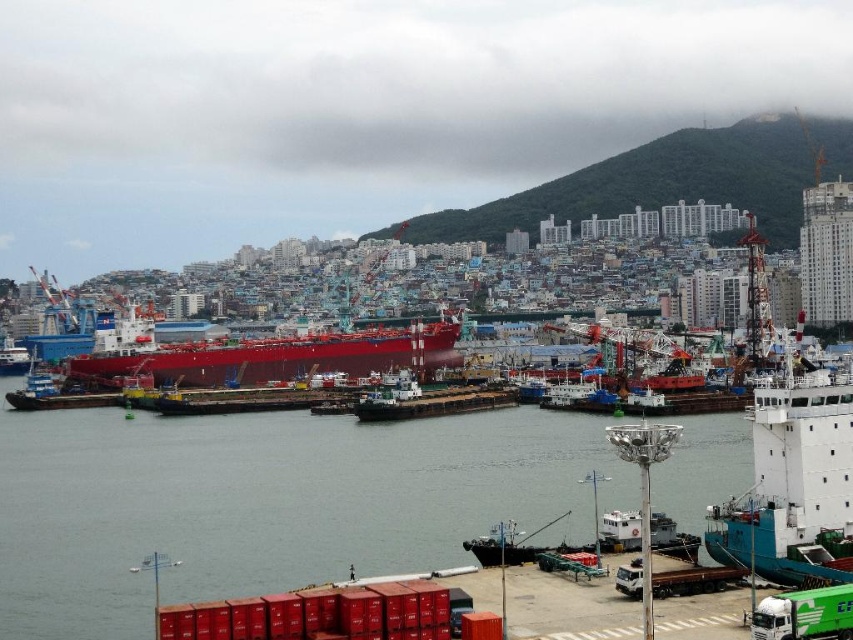
Between transparent water at center and white matte ship at right, which one has more height?

white matte ship at right

Does point (28, 614) lie in front of point (781, 392)?

No.

In order to click on transparent water at center in this screenshot , I will do `click(268, 502)`.

Is white matte ship at right smaller than glossy red ship at center?

Actually, white matte ship at right might be larger than glossy red ship at center.

Measure the distance between point (769,490) and camera.

The distance of point (769,490) from camera is 105.52 meters.

This screenshot has width=853, height=640. In order to click on white matte ship at right in this screenshot , I will do `click(793, 483)`.

Is transparent water at center positioned in front of glossy red ship at center?

Yes.

Can you confirm if transparent water at center is positioned to the left of glossy red ship at center?

No, transparent water at center is not to the left of glossy red ship at center.

Does point (693, 481) come closer to viewer compared to point (115, 369)?

Yes, point (693, 481) is in front of point (115, 369).

Image resolution: width=853 pixels, height=640 pixels. Find the location of `transparent water at center`. transparent water at center is located at coordinates (268, 502).